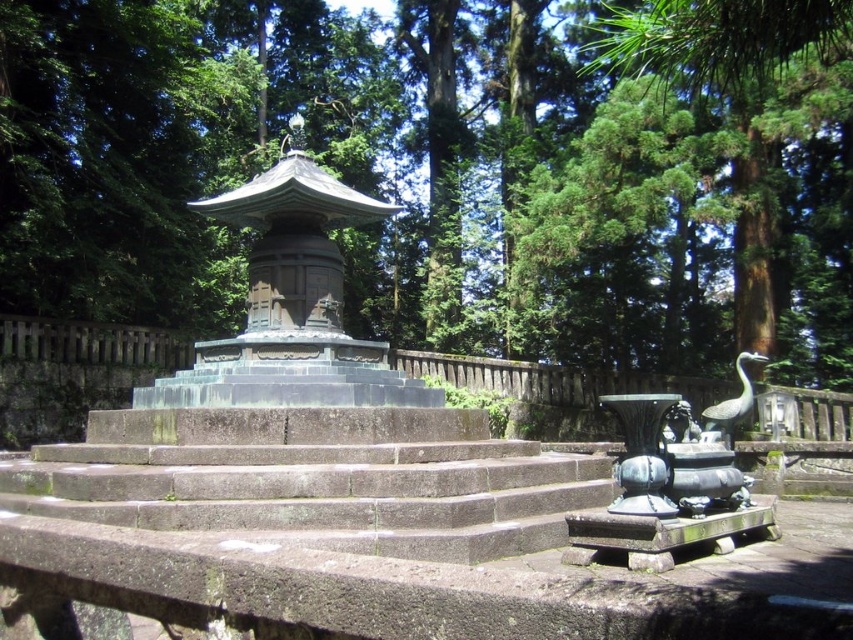
Does green leafy tree at center have a greater height compared to gray stone stairs at center?

Indeed, green leafy tree at center has a greater height compared to gray stone stairs at center.

Consider the image. Who is more distant from viewer, (830, 228) or (190, 512)?

Positioned behind is point (830, 228).

I want to click on green leafy tree at center, so click(x=431, y=180).